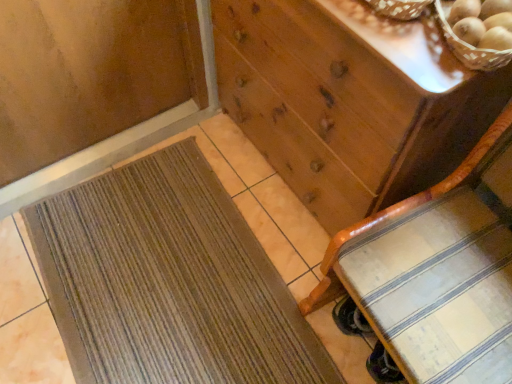
Question: Is wooden woven basket at upper right at the left side of brown textured mat at lower left?

Choices:
 (A) yes
 (B) no

Answer: (B)

Question: Is wooden woven basket at upper right looking in the opposite direction of brown textured mat at lower left?

Choices:
 (A) yes
 (B) no

Answer: (B)

Question: From the image's perspective, is wooden woven basket at upper right over brown textured mat at lower left?

Choices:
 (A) no
 (B) yes

Answer: (B)

Question: Is wooden woven basket at upper right next to brown textured mat at lower left?

Choices:
 (A) no
 (B) yes

Answer: (A)

Question: From the image's perspective, is wooden woven basket at upper right located beneath brown textured mat at lower left?

Choices:
 (A) no
 (B) yes

Answer: (A)

Question: Choose the correct answer: Is wooden chest of drawers at center inside brown textured mat at lower left or outside it?

Choices:
 (A) inside
 (B) outside

Answer: (B)

Question: Does point (436, 127) appear closer or farther from the camera than point (248, 332)?

Choices:
 (A) closer
 (B) farther

Answer: (A)

Question: Considering the relative positions of wooden chest of drawers at center and brown textured mat at lower left in the image provided, is wooden chest of drawers at center to the left or to the right of brown textured mat at lower left?

Choices:
 (A) left
 (B) right

Answer: (B)

Question: Considering their positions, is wooden chest of drawers at center located in front of or behind brown textured mat at lower left?

Choices:
 (A) behind
 (B) front

Answer: (B)

Question: Is brown textured mat at lower left taller or shorter than wooden chair at lower right?

Choices:
 (A) tall
 (B) short

Answer: (B)

Question: Does point (169, 314) appear closer or farther from the camera than point (371, 292)?

Choices:
 (A) farther
 (B) closer

Answer: (A)

Question: From a real-world perspective, is brown textured mat at lower left physically located above or below wooden chair at lower right?

Choices:
 (A) below
 (B) above

Answer: (A)

Question: Considering the relative positions of brown textured mat at lower left and wooden chair at lower right in the image provided, is brown textured mat at lower left to the left or to the right of wooden chair at lower right?

Choices:
 (A) left
 (B) right

Answer: (A)

Question: Is point (99, 319) positioned closer to the camera than point (355, 69)?

Choices:
 (A) closer
 (B) farther

Answer: (B)

Question: In the image, is brown textured mat at lower left positioned in front of or behind wooden chest of drawers at center?

Choices:
 (A) behind
 (B) front

Answer: (A)